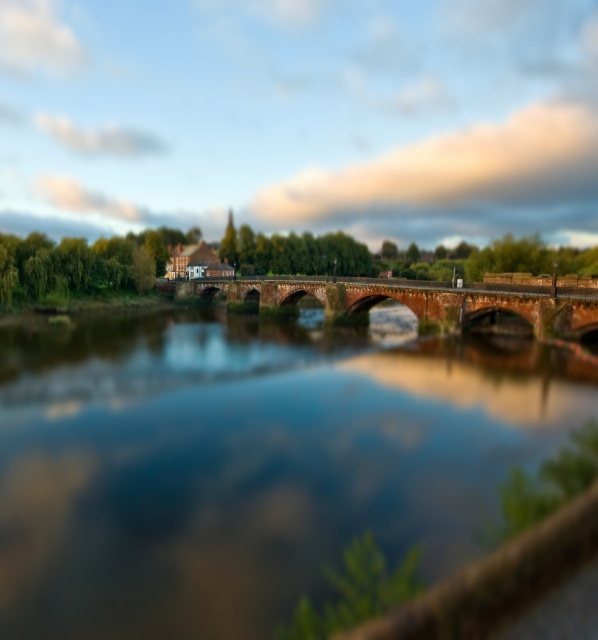
You are standing on the riverside and want to cross the river. There are two bridges in front of you, the brown stone bridge at center and the red brick bridge at center. Which bridge should you approach first?

You should approach the brown stone bridge at center first because it is closer to you than the red brick bridge at center.

You are standing on a path near the riverside and want to cross the river to reach the other side. The brown stone bridge at center is the only path available. Considering your height is 5 feet 6 inches, will you be able to walk under the bridge without hitting your head?

The brown stone bridge at center is 36.64 feet away from viewer. The height of the bridge is not provided, so it is impossible to determine if you can walk under it without hitting your head.

Based on the photo, you are an architect examining the riverside scene. You notice two bridges at the center of the image. Which bridge is shorter in height between the brown stone bridge at center and the red brick bridge at center?

The brown stone bridge at center is shorter in height compared to the red brick bridge at center.